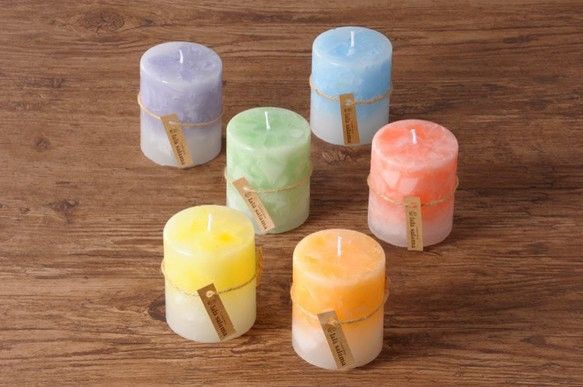
This screenshot has height=387, width=583. I want to click on candle, so click(x=220, y=310), click(x=328, y=272), click(x=393, y=159), click(x=372, y=89), click(x=237, y=136), click(x=159, y=72).